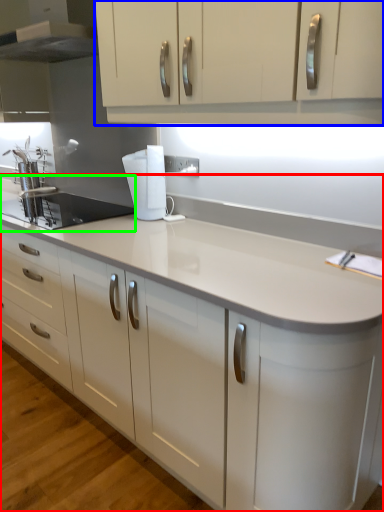
Question: Estimate the real-world distances between objects in this image. Which object is farther from countertop (highlighted by a red box), cabinetry (highlighted by a blue box) or sink (highlighted by a green box)?

Choices:
 (A) cabinetry
 (B) sink

Answer: (B)